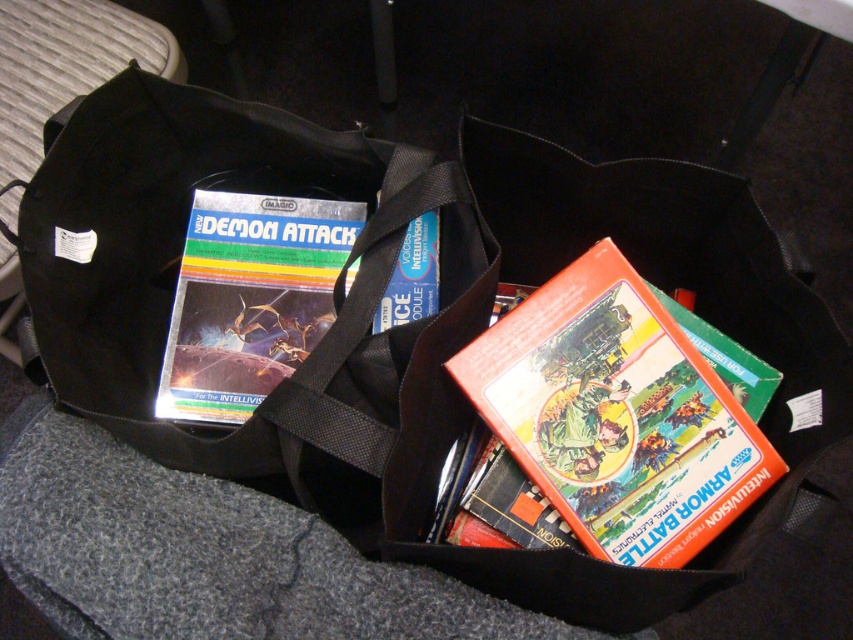
Looking at this image, who is lower down, orange matte game cartridge at center or metallic silver game cartridge at center-left?

orange matte game cartridge at center is below.

Image resolution: width=853 pixels, height=640 pixels. In order to click on orange matte game cartridge at center in this screenshot , I will do `click(616, 413)`.